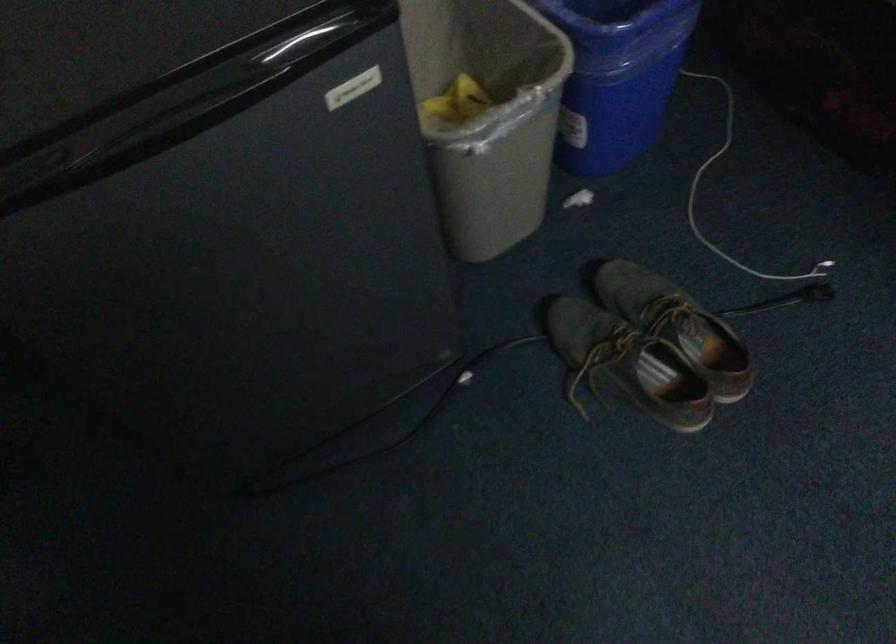
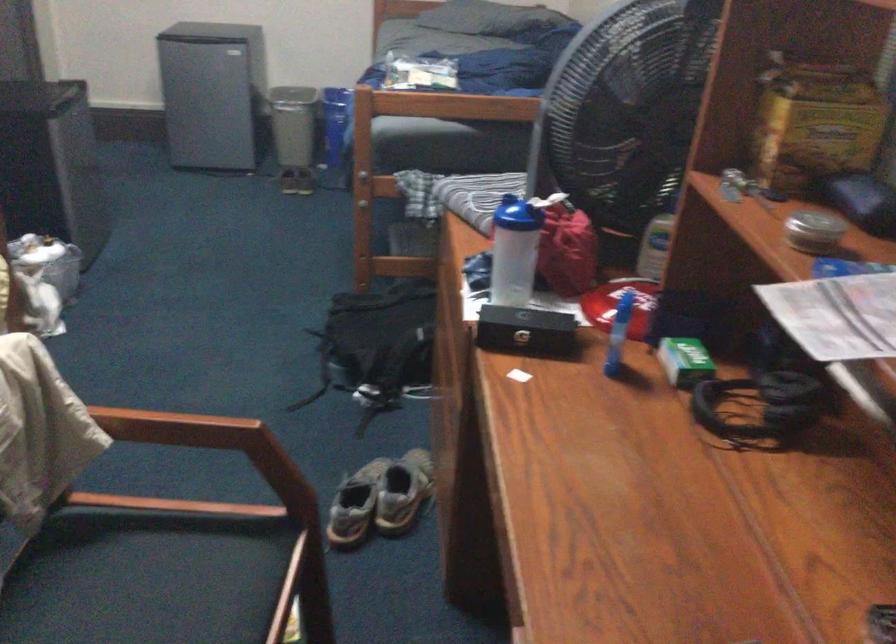
In the second image, find the point that corresponds to point 691,263 in the first image.

(293, 124)